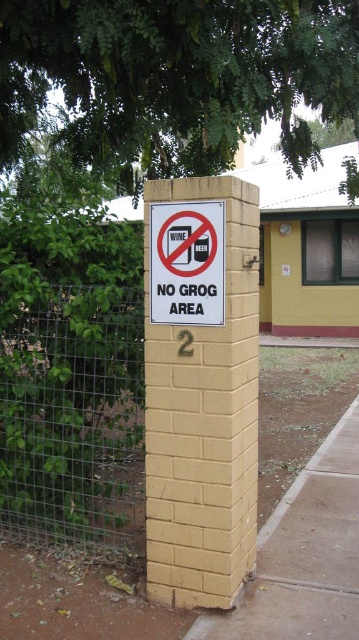
Question: Is green leafy tree at upper center smaller than wire mesh fence at left?

Choices:
 (A) no
 (B) yes

Answer: (A)

Question: Which object is positioned farthest from the yellow brick post at center?

Choices:
 (A) wire mesh fence at left
 (B) green leafy tree at upper center
 (C) white paper sign at center

Answer: (B)

Question: In this image, where is green leafy tree at upper center located relative to white paper sign at center?

Choices:
 (A) below
 (B) above

Answer: (B)

Question: Does green leafy tree at upper center have a lesser width compared to white paper sign at center?

Choices:
 (A) no
 (B) yes

Answer: (A)

Question: Based on their relative distances, which object is nearer to the white paper sign at center?

Choices:
 (A) yellow brick post at center
 (B) wire mesh fence at left
 (C) green leafy tree at upper center

Answer: (A)

Question: Which of the following is the farthest from the observer?

Choices:
 (A) green leafy tree at upper center
 (B) white paper sign at center
 (C) wire mesh fence at left
 (D) yellow brick post at center

Answer: (A)